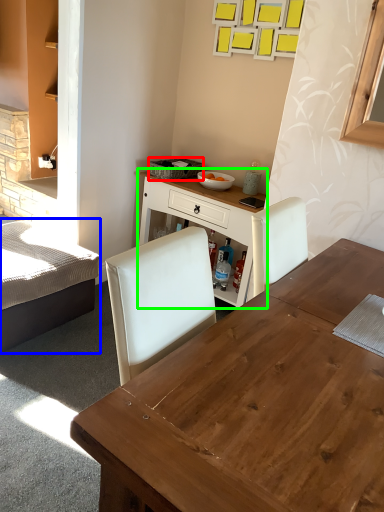
Question: Considering the real-world distances, which object is farthest from picnic basket (highlighted by a red box)? bed (highlighted by a blue box) or table (highlighted by a green box)?

Choices:
 (A) bed
 (B) table

Answer: (A)